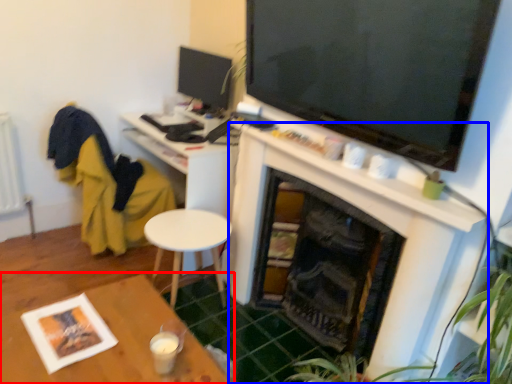
Question: Which point is closer to the camera, table (highlighted by a red box) or fireplace (highlighted by a blue box)?

Choices:
 (A) table
 (B) fireplace

Answer: (A)